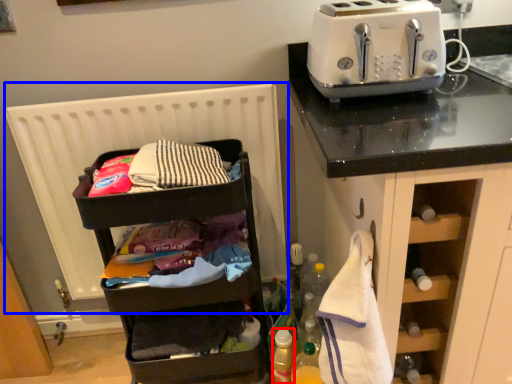
Question: Which object appears farthest to the camera in this image, bottle (highlighted by a red box) or radiator (highlighted by a blue box)?

Choices:
 (A) bottle
 (B) radiator

Answer: (A)